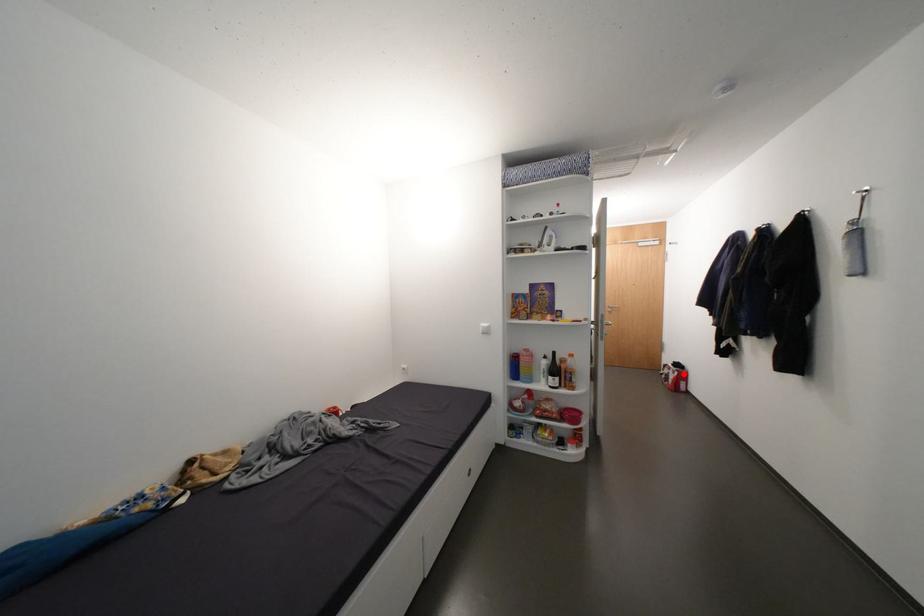
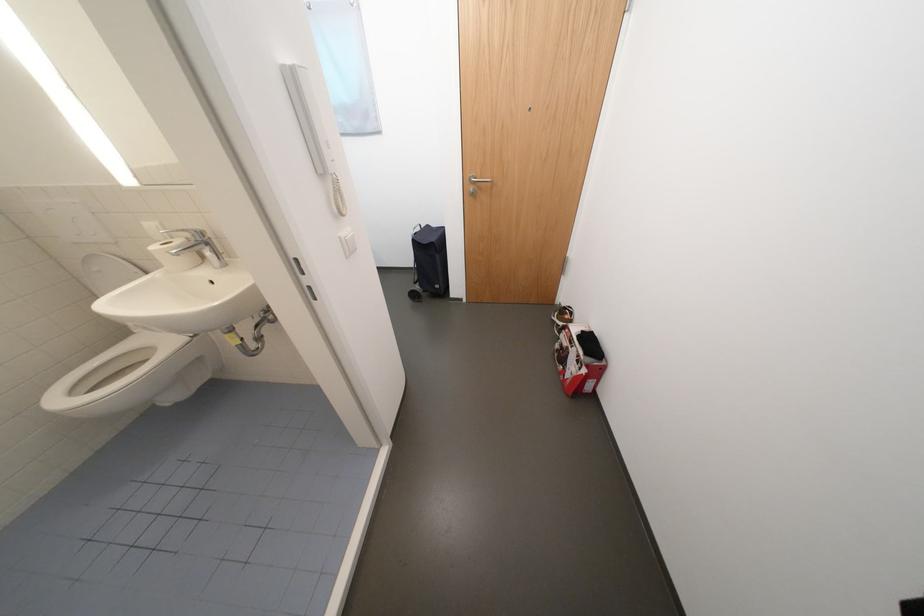
Question: I am providing you with two images of the same scene from different viewpoints. In image1, a red point is highlighted. Considering the same 3D point in image2, which of the following is correct?

Choices:
 (A) It is closer
 (B) It is farther

Answer: (B)